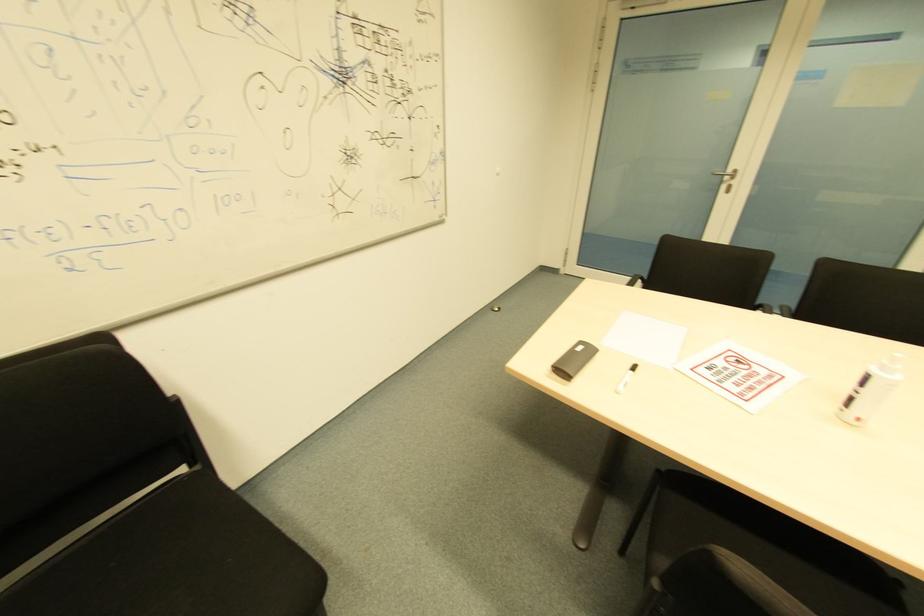
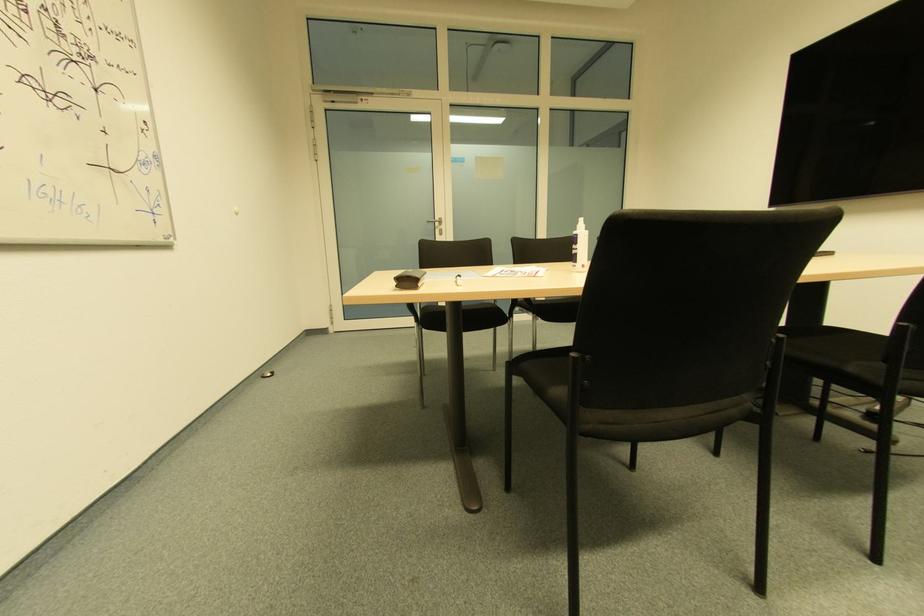
Question: How did the camera likely rotate?

Choices:
 (A) Left
 (B) Right
 (C) Up
 (D) Down

Answer: (B)